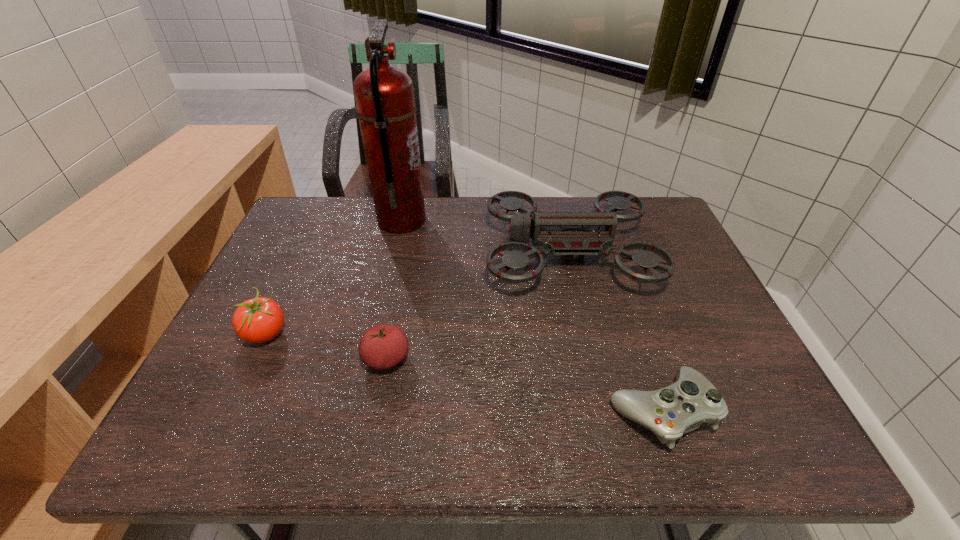
Image resolution: width=960 pixels, height=540 pixels. Identify the location of vacant space located on the back of the right tomato. click(396, 312).

This screenshot has height=540, width=960. In order to click on vacant space located 0.080m on the back of the shortest object in this screenshot , I will do `click(638, 345)`.

Locate an element on the screen. This screenshot has width=960, height=540. fire extinguisher positioned at the far edge is located at coordinates (384, 95).

You are a GUI agent. You are given a task and a screenshot of the screen. Output one action in this format:
    pyautogui.click(x=<x>, y=<y>)
    Task: Click on the drone that is at the far edge
    
    Given the screenshot: What is the action you would take?
    pyautogui.click(x=562, y=233)

Where is `object that is at the near edge`? The image size is (960, 540). object that is at the near edge is located at coordinates (681, 407).

Locate an element on the screen. The width and height of the screenshot is (960, 540). object that is at the left edge is located at coordinates (258, 320).

This screenshot has width=960, height=540. I want to click on drone located at the right edge, so click(x=562, y=233).

This screenshot has width=960, height=540. Identify the location of control at the right edge. (681, 407).

Where is `object that is at the far right corner`? This screenshot has height=540, width=960. object that is at the far right corner is located at coordinates (562, 233).

The image size is (960, 540). Find the location of `object located at the near right corner`. object located at the near right corner is located at coordinates (681, 407).